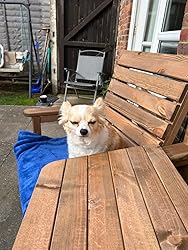
At what (x,y) coordinates should I click in order to perform the action: click on blue towel. Please return your answer as a coordinate pair (x, y). Looking at the image, I should click on (35, 156).